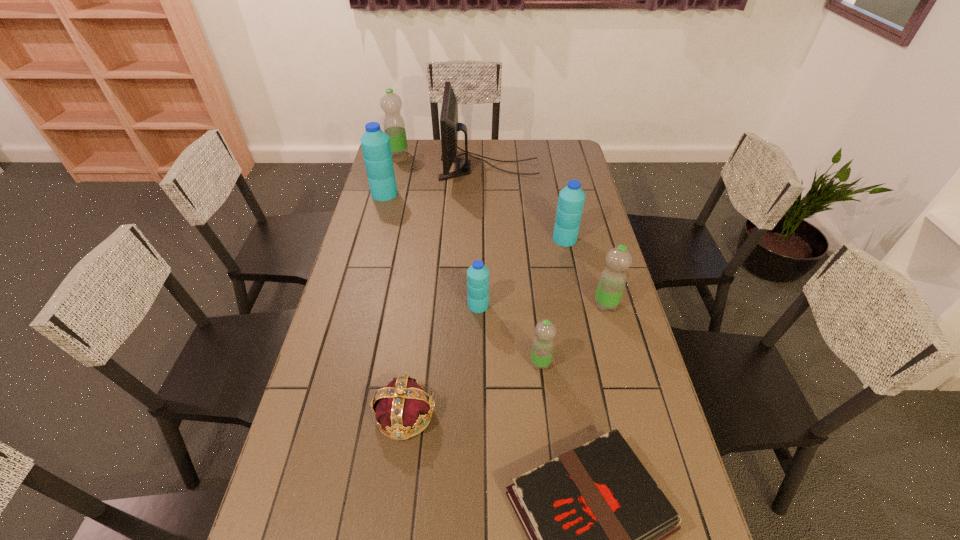
Locate an element on the screen. vacant position at the right edge of the desktop is located at coordinates (556, 201).

In the image, there is a desktop. Identify the location of vacant space at the far right corner. (582, 165).

You are a GUI agent. You are given a task and a screenshot of the screen. Output one action in this format:
    pyautogui.click(x=<x>, y=<y>)
    Task: Click on the blank region between the second smallest blue water bottle and the smallest blue water bottle
    The image size is (960, 540).
    Given the screenshot: What is the action you would take?
    pyautogui.click(x=521, y=272)

Where is `vacant space in between the farthest blue water bottle and the nearest green water bottle`? vacant space in between the farthest blue water bottle and the nearest green water bottle is located at coordinates (463, 278).

In order to click on unoccupied area between the fourth nearest water bottle and the second farthest green water bottle in this screenshot , I will do `click(586, 272)`.

Identify the location of free space between the eighth tallest object and the fourth water bottle from right to left. The height and width of the screenshot is (540, 960). (442, 360).

Where is `blank region between the biggest blue water bottle and the smallest blue water bottle`? The height and width of the screenshot is (540, 960). blank region between the biggest blue water bottle and the smallest blue water bottle is located at coordinates (431, 249).

Where is `empty location between the computer monitor and the second farthest water bottle`? empty location between the computer monitor and the second farthest water bottle is located at coordinates (437, 181).

You are a GUI agent. You are given a task and a screenshot of the screen. Output one action in this format:
    pyautogui.click(x=<x>, y=<y>)
    Task: Click on the vacant area between the fifth nearest water bottle and the third farthest water bottle
    The width and height of the screenshot is (960, 540).
    Given the screenshot: What is the action you would take?
    pyautogui.click(x=474, y=216)

Locate an element on the screen. vacant region between the computer monitor and the second farthest water bottle is located at coordinates click(x=437, y=181).